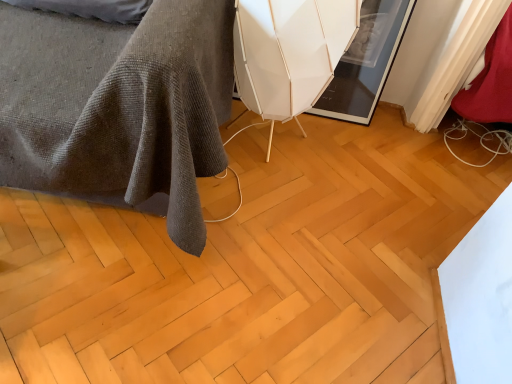
Where is `free point below white matte swivel chair at center (from a real-world perspective)`? free point below white matte swivel chair at center (from a real-world perspective) is located at coordinates (270, 144).